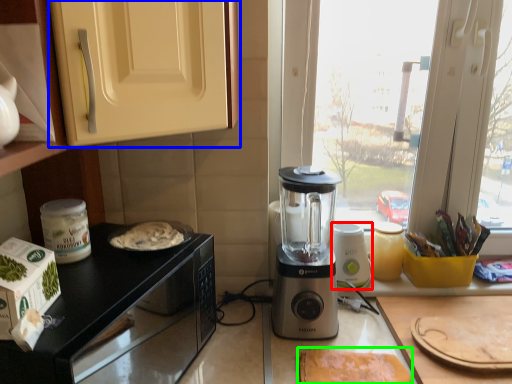
Question: Based on their relative distances, which object is farther from blender (highlighted by a red box)? Choose from cabinetry (highlighted by a blue box) and food (highlighted by a green box).

Choices:
 (A) cabinetry
 (B) food

Answer: (A)